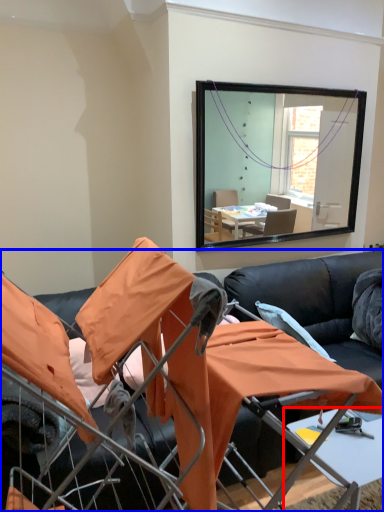
Question: Which point is closer to the camera, table (highlighted by a red box) or studio couch (highlighted by a blue box)?

Choices:
 (A) table
 (B) studio couch

Answer: (B)